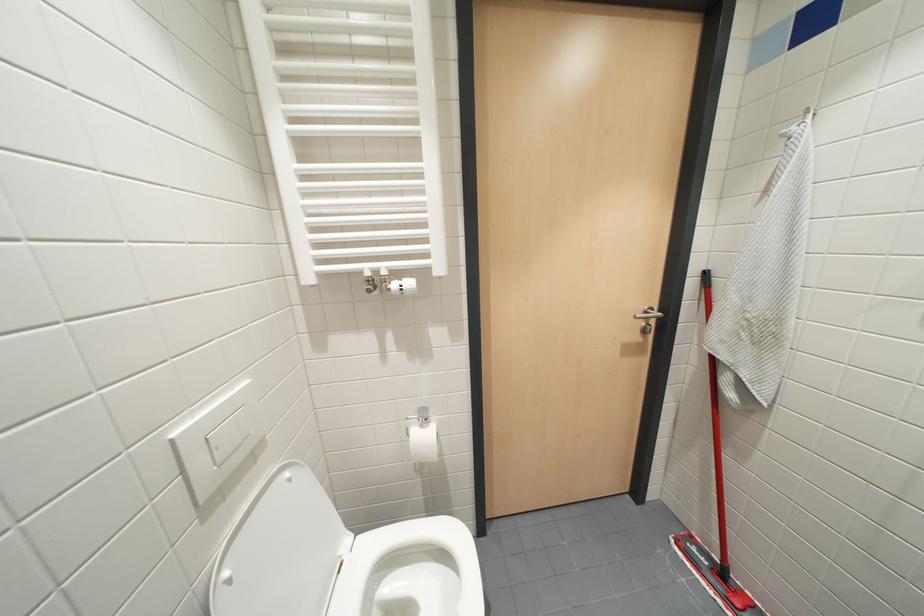
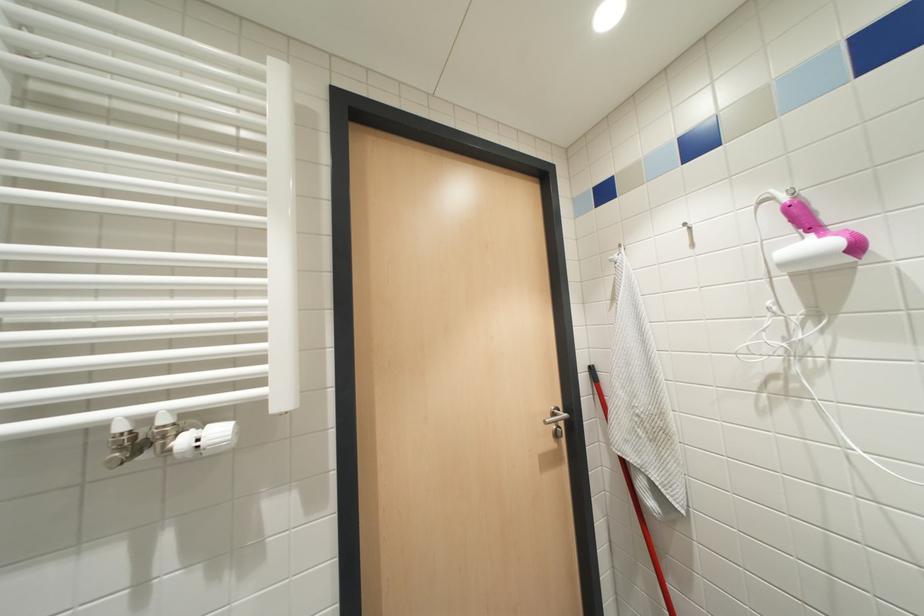
The first image is from the beginning of the video and the second image is from the end. How did the camera likely rotate when shooting the video?

The camera rotated toward right-up.